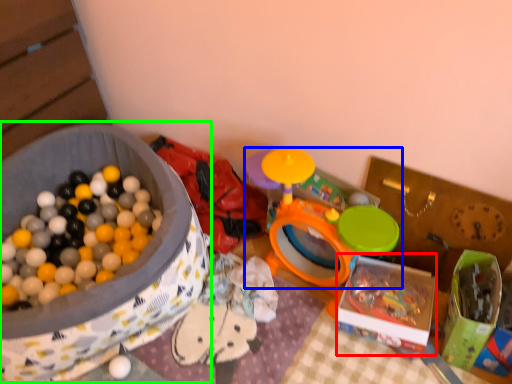
Question: Which object is the closest to the storage box (highlighted by a red box)? Choose among these: toy (highlighted by a blue box) or storage box (highlighted by a green box).

Choices:
 (A) toy
 (B) storage box

Answer: (A)